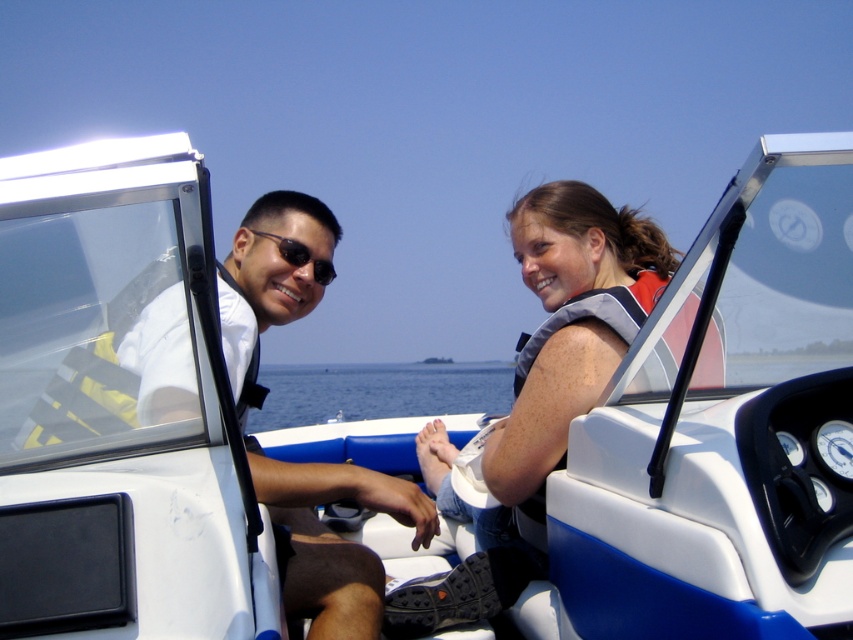
You are a photographer on a nearby boat and want to capture a photo of the gray fabric life vest at center and the blue water at center. Which object will appear larger in the photo?

The gray fabric life vest at center is smaller than the blue water at center, so the blue water at center will appear larger in the photo.

You are a safety inspector checking the boat for proper equipment placement. According to the image, which object, the gray fabric life vest at center or the blue water at center, is positioned higher?

The gray fabric life vest at center is higher than the blue water at center.

You are a passenger in the motorboat and want to reach a point in front of you. Which of the two points, point (389, 616) or point (318, 275), is closer to your destination?

Point (389, 616) is in front of point (318, 275), so it is closer to your destination.